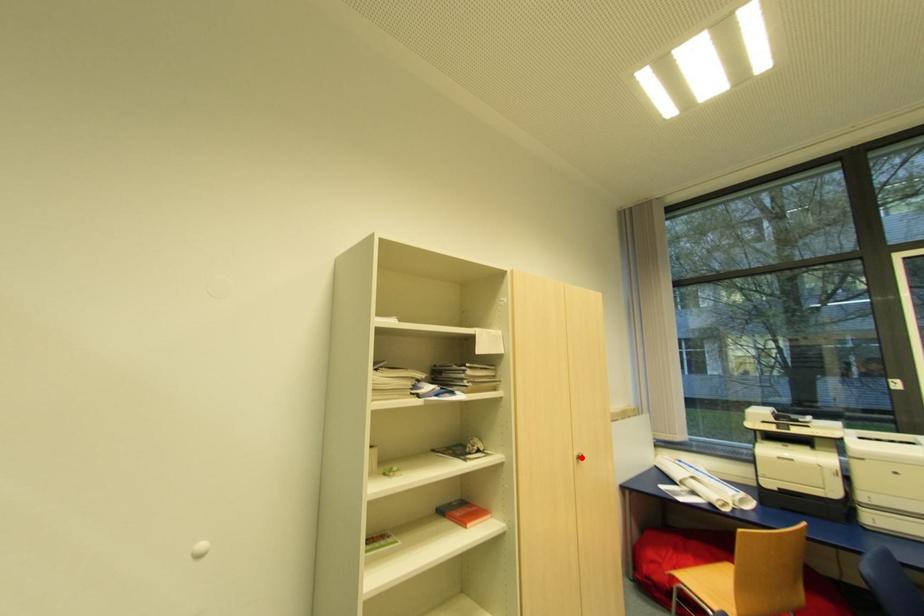
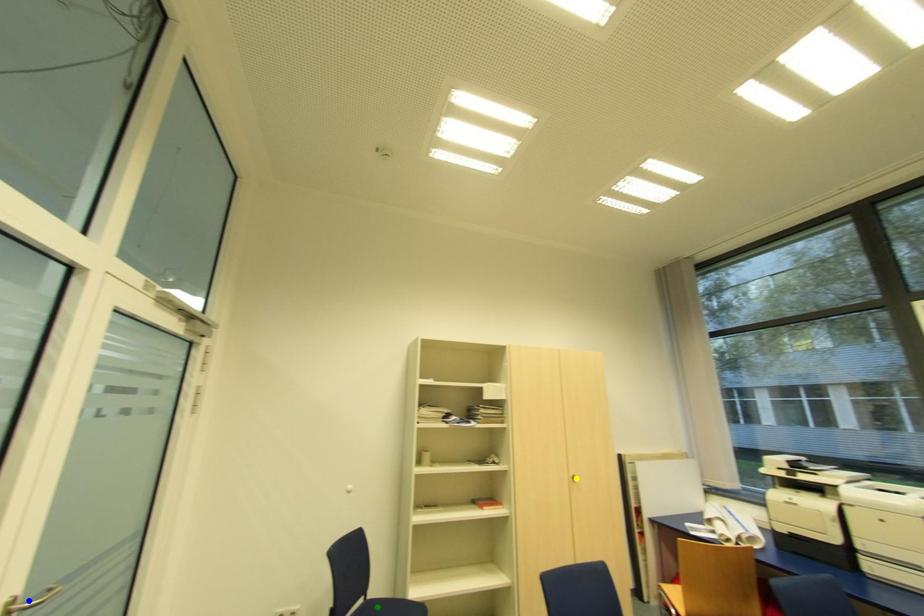
Question: I am providing you with two images of the same scene from different viewpoints. A red point is marked on the first image. You are given multiple points on the second image. Which point in image 2 is actually the same real-world point as the red point in image 1?

Choices:
 (A) green point
 (B) blue point
 (C) yellow point

Answer: (C)